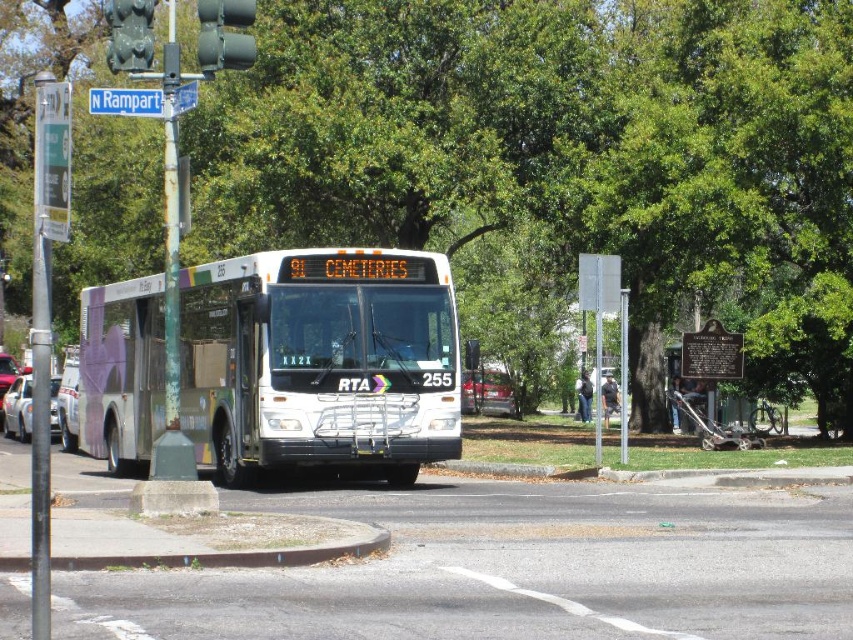
Can you confirm if green matte traffic light at upper left is thinner than white glossy sedan at left?

Correct, green matte traffic light at upper left's width is less than white glossy sedan at left's.

Is point (131, 52) positioned in front of point (22, 412)?

Yes, it is in front of point (22, 412).

Locate an element on the screen. green matte traffic light at upper left is located at coordinates (129, 35).

Is white glossy sedan at left positioned behind metallic silver car at left?

That is False.

Who is positioned more to the left, white glossy sedan at left or metallic silver car at left?

metallic silver car at left is more to the left.

What do you see at coordinates (18, 408) in the screenshot?
I see `white glossy sedan at left` at bounding box center [18, 408].

At what (x,y) coordinates should I click in order to perform the action: click on white glossy sedan at left. Please return your answer as a coordinate pair (x, y). The height and width of the screenshot is (640, 853). Looking at the image, I should click on (18, 408).

Which is in front, point (811, 35) or point (241, 58)?

Positioned in front is point (241, 58).

Is the position of green leafy tree at center less distant than that of green matte traffic light at upper center?

That is False.

Find the location of `green leafy tree at center`. green leafy tree at center is located at coordinates (563, 154).

The image size is (853, 640). In order to click on green leafy tree at center in this screenshot , I will do `click(563, 154)`.